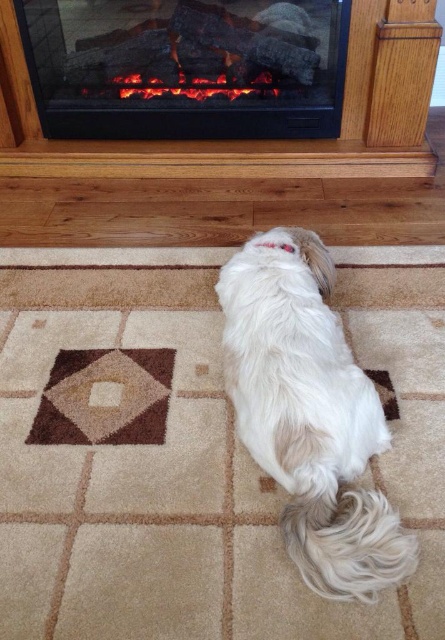
Is black electric fireplace at upper center below white fluffy dog at center?

Incorrect, black electric fireplace at upper center is not positioned below white fluffy dog at center.

Is black electric fireplace at upper center to the right of white fluffy dog at center from the viewer's perspective?

In fact, black electric fireplace at upper center is to the left of white fluffy dog at center.

Is point (108, 115) closer to viewer compared to point (332, 384)?

No, it is not.

You are a GUI agent. You are given a task and a screenshot of the screen. Output one action in this format:
    pyautogui.click(x=<x>, y=<y>)
    Task: Click on the black electric fireplace at upper center
    
    Given the screenshot: What is the action you would take?
    pyautogui.click(x=186, y=67)